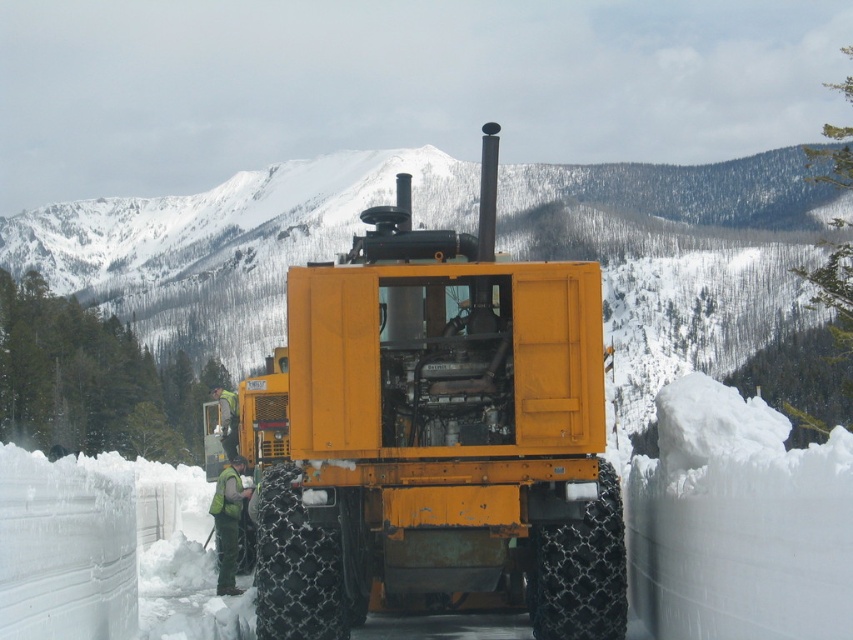
You are a worker wearing a green fabric vest at center and need to locate the matte yellow tractor at center. Based on your position, which direction should you move to find it?

The matte yellow tractor at center is to the right of the green fabric vest at center, so you should move to your right to locate it.

You are a worker who needs to put on the green fabric vest at center before operating the matte yellow tractor at center. Can you easily reach the vest while standing next to the tractor?

The matte yellow tractor at center is much taller than the green fabric vest at center, so you can easily reach the vest while standing next to the tractor.

You are standing at the snowplow and want to reach the two points marked in the image. Which point, point (225, 545) or point (233, 444), is closer to you?

Point (225, 545) is closer to the viewer than point (233, 444).